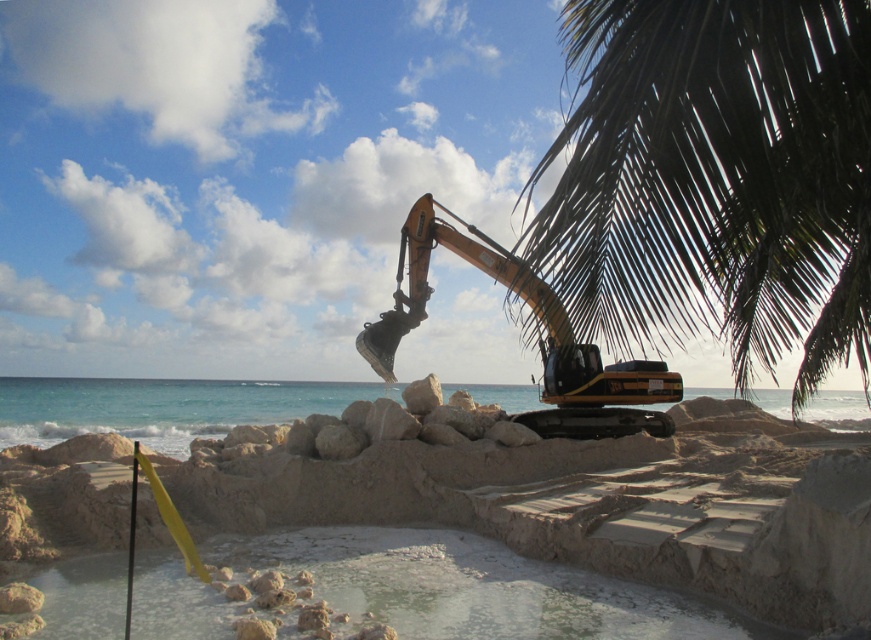
You are a construction worker observing the scene. You need to determine if the dark green leafy palm tree at upper right is blocking the excavator operator from seeing the yellow metallic excavator at center. Can you confirm?

The dark green leafy palm tree at upper right is located above the yellow metallic excavator at center, so it might block the operator from seeing the excavator.

From the picture: Based on the scene described, where is the smooth sand beach at center located relative to the dark green leafy palm tree at upper right?

The smooth sand beach at center is to the left of the dark green leafy palm tree at upper right.